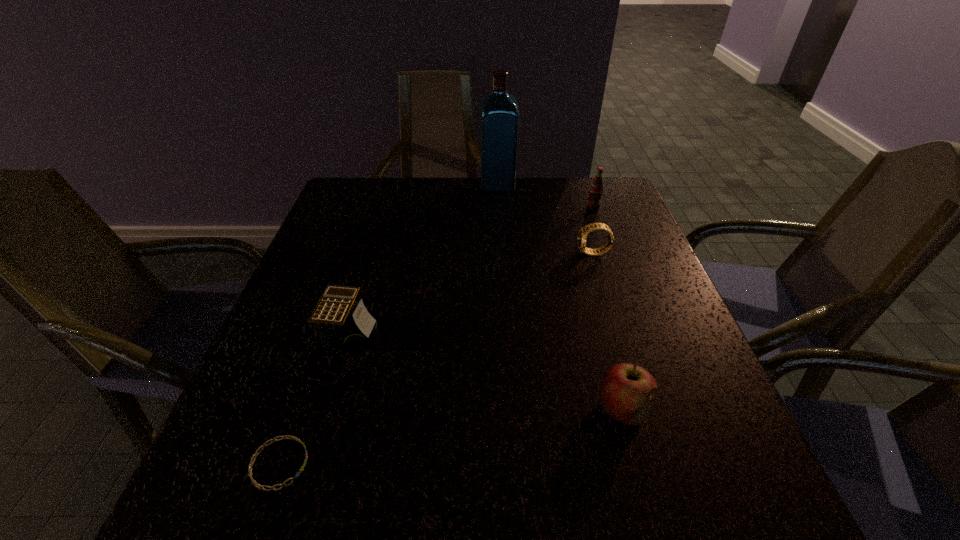
At what (x,y) coordinates should I click in order to perform the action: click on soda located at the far edge. Please return your answer as a coordinate pair (x, y). The width and height of the screenshot is (960, 540). Looking at the image, I should click on (596, 188).

This screenshot has height=540, width=960. I want to click on object at the near edge, so click(254, 482).

The height and width of the screenshot is (540, 960). I want to click on calculator at the left edge, so click(x=344, y=325).

At what (x,y) coordinates should I click in order to perform the action: click on bracelet that is positioned at the left edge. Please return your answer as a coordinate pair (x, y). Looking at the image, I should click on (254, 482).

At what (x,y) coordinates should I click in order to perform the action: click on soda at the right edge. Please return your answer as a coordinate pair (x, y). Looking at the image, I should click on (596, 188).

Image resolution: width=960 pixels, height=540 pixels. I want to click on apple that is positioned at the right edge, so click(x=626, y=390).

Locate an element on the screen. Image resolution: width=960 pixels, height=540 pixels. watch that is at the right edge is located at coordinates (582, 235).

At what (x,y) coordinates should I click in order to perform the action: click on object present at the near left corner. Please return your answer as a coordinate pair (x, y). Image resolution: width=960 pixels, height=540 pixels. Looking at the image, I should click on 254,482.

Locate an element on the screen. Image resolution: width=960 pixels, height=540 pixels. object that is at the far right corner is located at coordinates (596, 188).

In order to click on vacant region at the far edge of the desktop in this screenshot , I will do `click(434, 215)`.